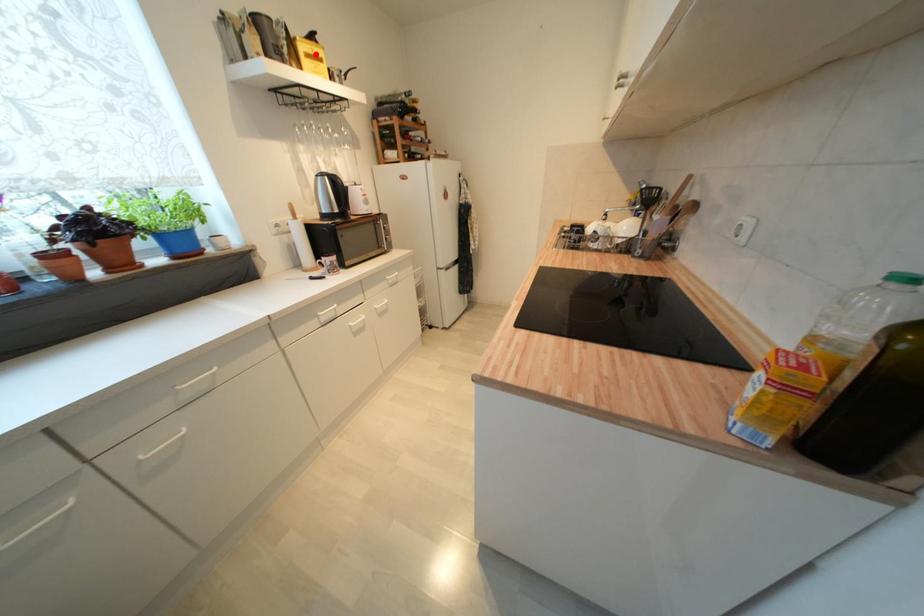
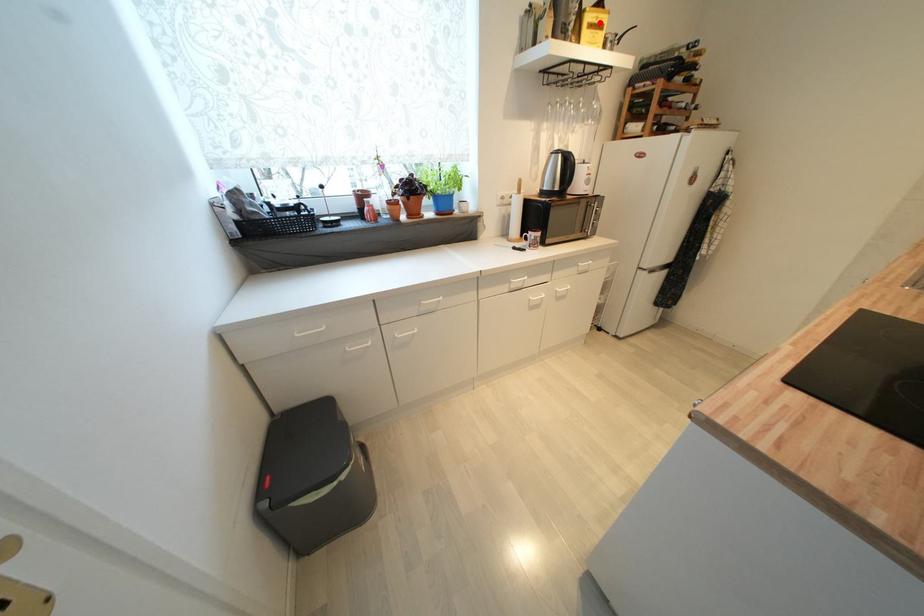
I am providing you with two images of the same scene from different viewpoints. A red point is marked on the first image and another point is marked on the second image. Does the point marked in image1 correspond to the same location as the one in image2?

Yes